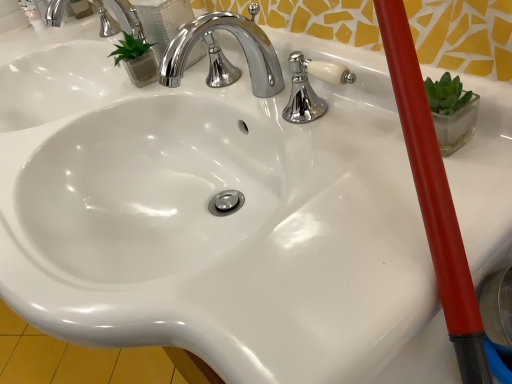
Question: Considering the relative positions of polished chrome faucet at upper center, which ranks as the second tap in bottom-to-top order, and chrome/metallic faucet at center, which is the 2th tap from left to right, in the image provided, is polished chrome faucet at upper center, which ranks as the second tap in bottom-to-top order, to the left or to the right of chrome/metallic faucet at center, which is the 2th tap from left to right,?

Choices:
 (A) left
 (B) right

Answer: (A)

Question: Considering their positions, is polished chrome faucet at upper center, which appears as the 1th tap when viewed from the left, located in front of or behind chrome/metallic faucet at center, the first tap when ordered from front to back?

Choices:
 (A) behind
 (B) front

Answer: (A)

Question: Considering the positions of point (57, 18) and point (205, 21), is point (57, 18) closer or farther from the camera than point (205, 21)?

Choices:
 (A) closer
 (B) farther

Answer: (B)

Question: In the image, is chrome/metallic faucet at center, the second tap positioned from the top, positioned in front of or behind polished chrome faucet at upper center, which appears as the 1th tap when viewed from the top?

Choices:
 (A) front
 (B) behind

Answer: (A)

Question: Considering the positions of point (258, 64) and point (99, 4), is point (258, 64) closer or farther from the camera than point (99, 4)?

Choices:
 (A) closer
 (B) farther

Answer: (A)

Question: From the image's perspective, is chrome/metallic faucet at center, acting as the 2th tap starting from the back, located above or below polished chrome faucet at upper center, which appears as the 1th tap when viewed from the left?

Choices:
 (A) above
 (B) below

Answer: (B)

Question: From a real-world perspective, relative to polished chrome faucet at upper center, which is the first tap from back to front, is chrome/metallic faucet at center, the 1th tap in the right-to-left sequence, vertically above or below?

Choices:
 (A) below
 (B) above

Answer: (A)